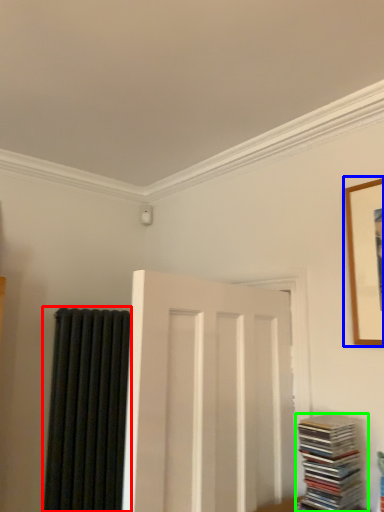
Question: Based on their relative distances, which object is farther from curtain (highlighted by a red box)? Choose from picture frame (highlighted by a blue box) and book (highlighted by a green box).

Choices:
 (A) picture frame
 (B) book

Answer: (A)